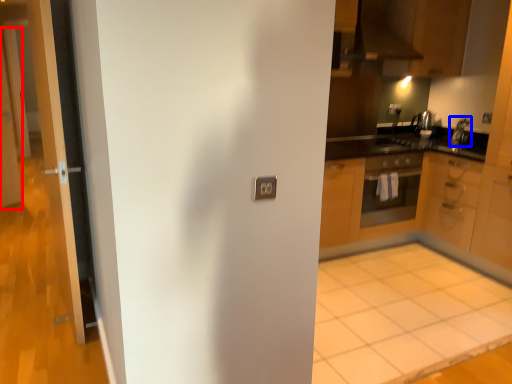
Question: Which object appears closest to the camera in this image, screen door (highlighted by a red box) or appliance (highlighted by a blue box)?

Choices:
 (A) screen door
 (B) appliance

Answer: (B)